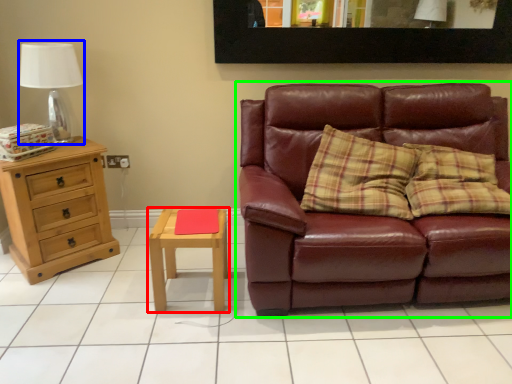
Question: Considering the real-world distances, which object is closest to nightstand (highlighted by a red box)? table lamp (highlighted by a blue box) or studio couch (highlighted by a green box).

Choices:
 (A) table lamp
 (B) studio couch

Answer: (B)